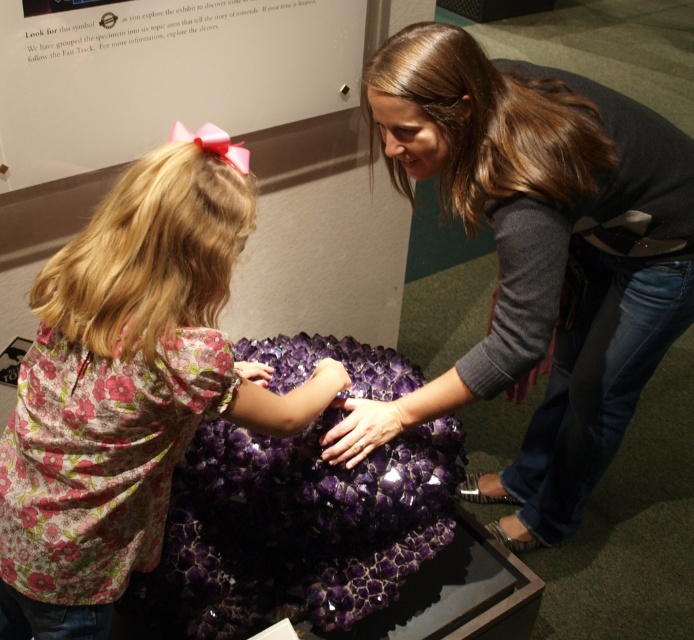
Question: Is matte purple rock at center positioned before floral fabric shirt at lower left?

Choices:
 (A) no
 (B) yes

Answer: (A)

Question: Can you confirm if matte purple rock at center is smaller than floral fabric shirt at lower left?

Choices:
 (A) yes
 (B) no

Answer: (B)

Question: Is matte purple rock at center positioned behind floral fabric shirt at lower left?

Choices:
 (A) no
 (B) yes

Answer: (B)

Question: Which point appears farthest from the camera in this image?

Choices:
 (A) (482, 54)
 (B) (244, 396)

Answer: (A)

Question: Which point is farther from the camera taking this photo?

Choices:
 (A) (81, 241)
 (B) (530, 220)

Answer: (B)